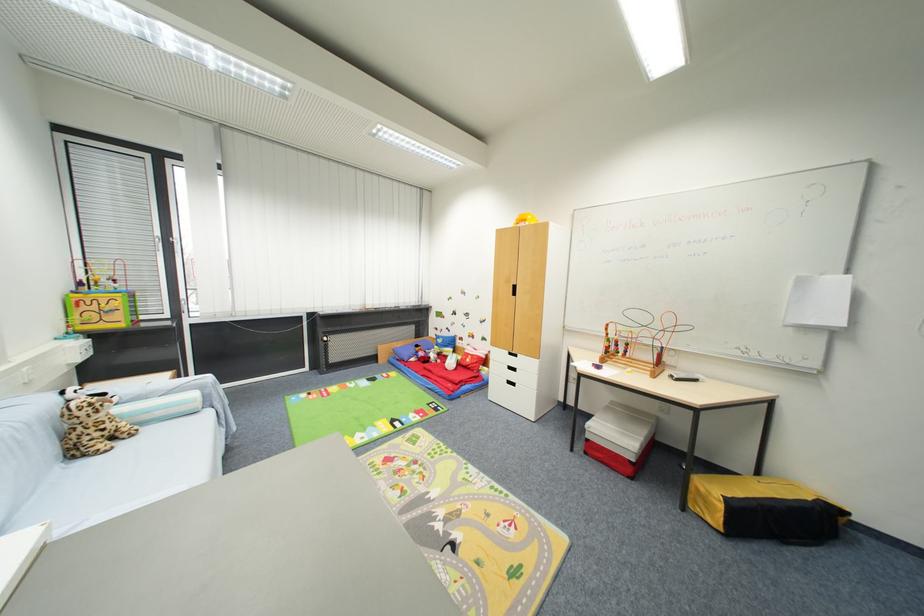
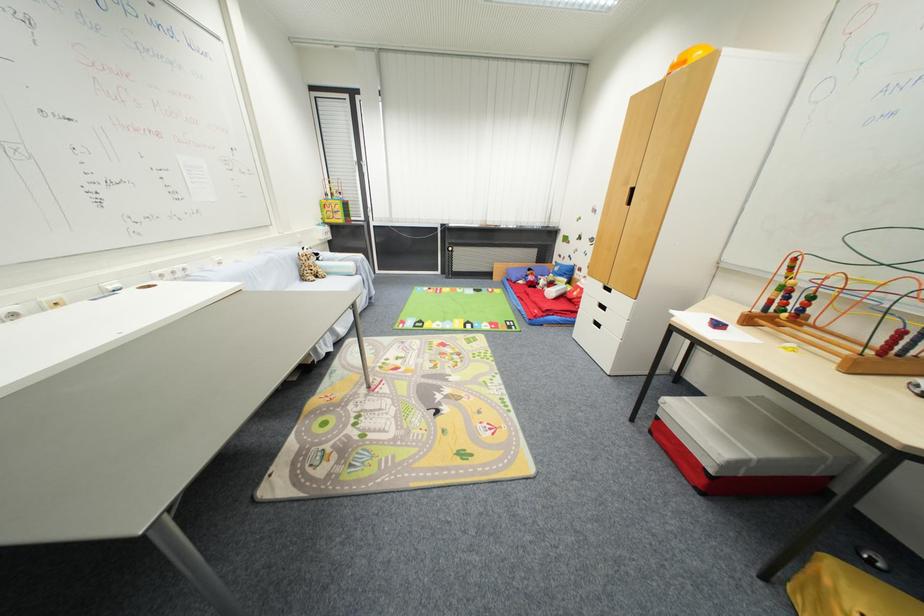
The point at (613, 410) is marked in the first image. Where is the corresponding point in the second image?

(745, 402)